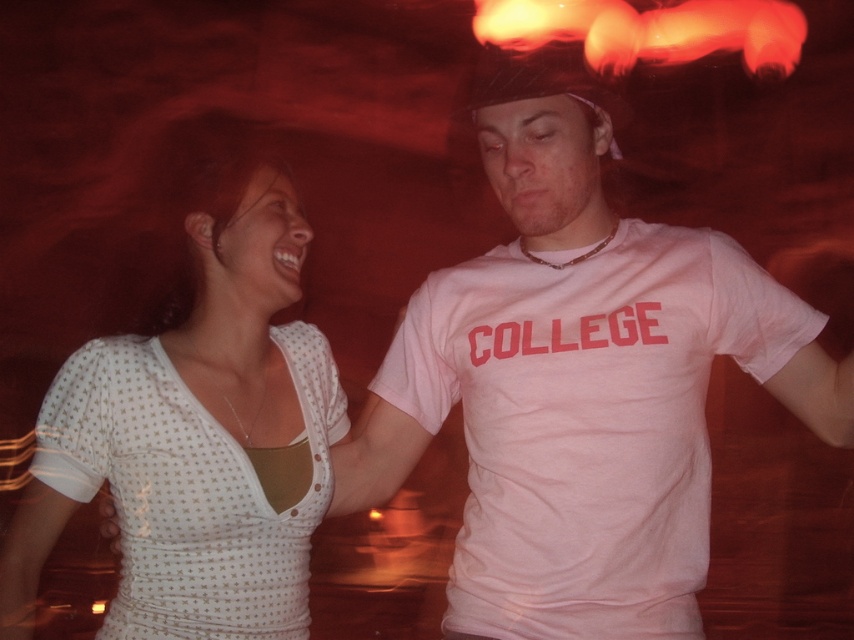
Can you confirm if pink cotton t-shirt at center is taller than white dotted fabric at center?

Correct, pink cotton t-shirt at center is much taller as white dotted fabric at center.

Does point (662, 298) come behind point (265, 476)?

Yes.

At what (x,y) coordinates should I click in order to perform the action: click on pink cotton t-shirt at center. Please return your answer as a coordinate pair (x, y). This screenshot has height=640, width=854. Looking at the image, I should click on (578, 380).